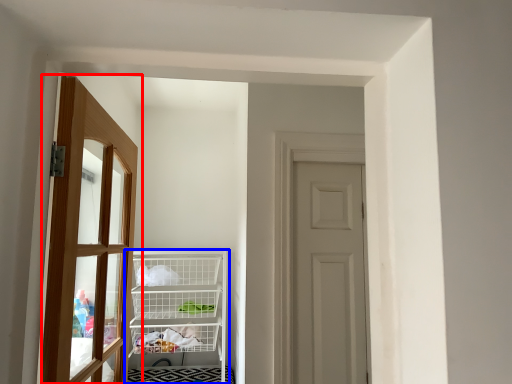
Question: Which object appears closest to the camera in this image, door (highlighted by a red box) or shelf (highlighted by a blue box)?

Choices:
 (A) door
 (B) shelf

Answer: (A)